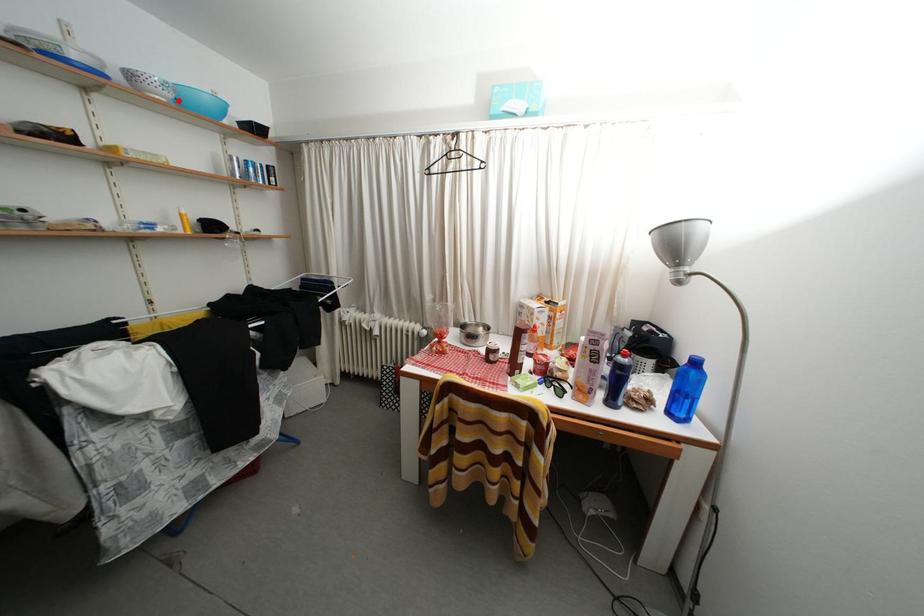
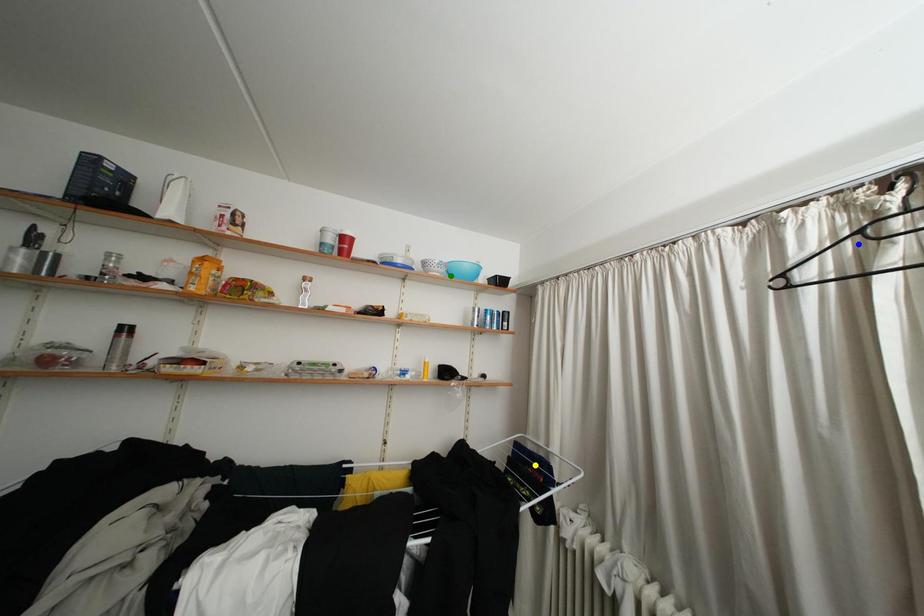
Question: I am providing you with two images of the same scene from different viewpoints. A red point is marked on the first image. You are given multiple points on the second image. Which spot in image 2 lines up with the point in image 1?

Choices:
 (A) green point
 (B) yellow point
 (C) blue point

Answer: (A)